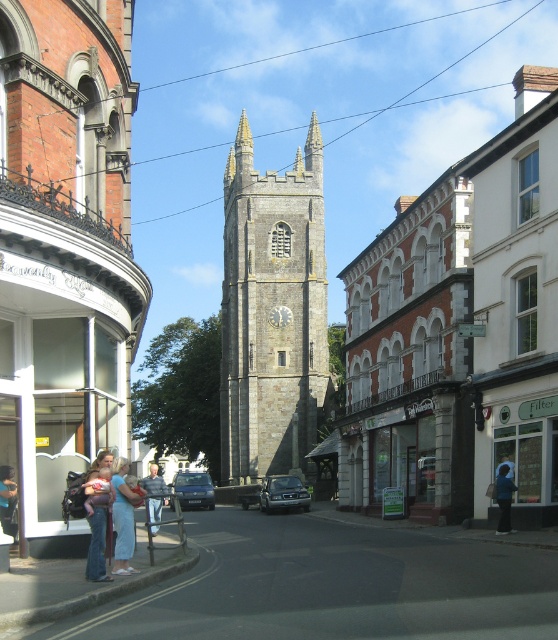
You are standing at the corner of the street, near the curved facade building with the sign Leavenly Hall. You want to walk to the metallic silver sedan at center. Which direction should you head?

You should head towards the center of the street to reach the metallic silver sedan at center.

You are a delivery driver who needs to park your metallic blue car at center in a parking spot that can only accommodate vehicles thinner than the denim jacket at lower left. Is your car suitable for the parking spot?

The metallic blue car at center is thinner than the denim jacket at lower left, so it is suitable for the parking spot.

You are standing at the entrance of the town square and want to take a photo of the white brick church at center. If your camera can focus on objects up to 50 meters away, will it be able to capture the church clearly?

The white brick church at center is 52.17 meters away from the camera. Since the camera can only focus up to 50 meters, it will not be able to capture the church clearly.